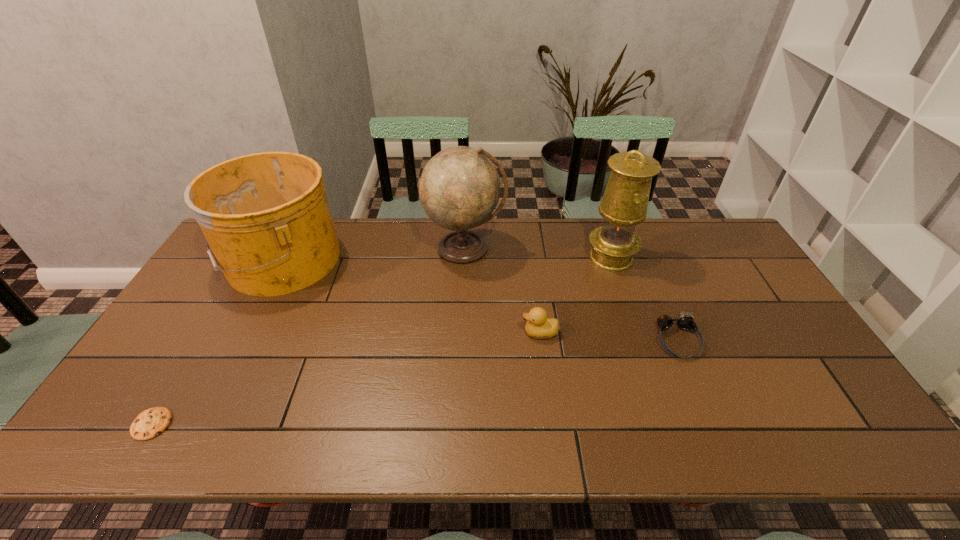
You are a GUI agent. You are given a task and a screenshot of the screen. Output one action in this format:
    pyautogui.click(x=<x>, y=<y>)
    Task: Click on the free space located 0.080m on the front of the bucket
    Image resolution: width=960 pixels, height=540 pixels.
    Given the screenshot: What is the action you would take?
    pyautogui.click(x=250, y=321)

At what (x,y) coordinates should I click in order to perform the action: click on vacant region located 0.130m facing forward on the fourth object from left to right. Please return your answer as a coordinate pair (x, y). The width and height of the screenshot is (960, 540). Looking at the image, I should click on click(474, 333).

This screenshot has width=960, height=540. Identify the location of vacant space situated 0.130m facing forward on the fourth object from left to right. (474, 333).

You are a GUI agent. You are given a task and a screenshot of the screen. Output one action in this format:
    pyautogui.click(x=<x>, y=<y>)
    Task: Click on the free spot located 0.330m facing forward on the fourth object from left to right
    The width and height of the screenshot is (960, 540).
    Given the screenshot: What is the action you would take?
    pyautogui.click(x=402, y=333)

I want to click on vacant space located through the lenses of the fifth tallest object, so (695, 384).

The height and width of the screenshot is (540, 960). Identify the location of free spot located on the back of the cookie. (198, 348).

Locate an element on the screen. The width and height of the screenshot is (960, 540). oil lamp present at the far edge is located at coordinates (624, 204).

Locate an element on the screen. Image resolution: width=960 pixels, height=540 pixels. globe that is at the far edge is located at coordinates (459, 188).

Find the location of `bucket at the far edge`. bucket at the far edge is located at coordinates (266, 217).

Identify the location of object present at the near edge. (150, 423).